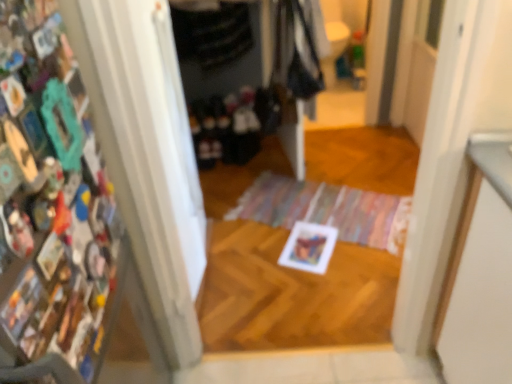
Image resolution: width=512 pixels, height=384 pixels. What do you see at coordinates (212, 33) in the screenshot?
I see `dark gray fabric at upper center, the 2th clothing ordered from the bottom` at bounding box center [212, 33].

You are a GUI agent. You are given a task and a screenshot of the screen. Output one action in this format:
    pyautogui.click(x=<x>, y=<y>)
    Task: Click on the dark fabric clothes at center, which ranks as the 2th clothing in top-to-bottom order
    This screenshot has height=384, width=512.
    Given the screenshot: What is the action you would take?
    pyautogui.click(x=233, y=125)

The height and width of the screenshot is (384, 512). Identify the location of dark gray fabric at upper center, the first clothing viewed from the top. click(x=212, y=33).

Is dark fabric clothes at center, which ranks as the 2th clothing in top-to-bottom order, not within multicolored collage at left?

Yes.

Is dark fabric clothes at center, which ranks as the 2th clothing in top-to-bottom order, behind multicolored collage at left?

Yes, the depth of dark fabric clothes at center, which ranks as the 2th clothing in top-to-bottom order, is greater than that of multicolored collage at left.

I want to click on book that appears above the dark fabric clothes at center, arranged as the first clothing when ordered from the bottom (from a real-world perspective), so click(x=50, y=199).

From a real-world perspective, is dark fabric clothes at center, arranged as the first clothing when ordered from the bottom, over multicolored collage at left?

Actually, dark fabric clothes at center, arranged as the first clothing when ordered from the bottom, is physically below multicolored collage at left in the real world.

How different are the orientations of dark gray fabric at upper center, the first clothing viewed from the top, and multicolored collage at left in degrees?

The angle between the facing direction of dark gray fabric at upper center, the first clothing viewed from the top, and the facing direction of multicolored collage at left is 92.2 degrees.

Is dark gray fabric at upper center, the 2th clothing ordered from the bottom, positioned with its back to multicolored collage at left?

No, dark gray fabric at upper center, the 2th clothing ordered from the bottom, is not facing the opposite direction of multicolored collage at left.

Where is `clothing that is the 1st one when counting backward from the multicolored collage at left`? The image size is (512, 384). clothing that is the 1st one when counting backward from the multicolored collage at left is located at coordinates (212, 33).

Which object is thinner, dark gray fabric at upper center, the first clothing viewed from the top, or multicolored collage at left?

Thinner between the two is multicolored collage at left.

From the image's perspective, is multicolored collage at left over multicolored woven mat at center?

Yes, from the image's perspective, multicolored collage at left is on top of multicolored woven mat at center.

Is multicolored collage at left looking in the opposite direction of multicolored woven mat at center?

No, multicolored woven mat at center is not at the back of multicolored collage at left.

How different are the orientations of multicolored collage at left and multicolored woven mat at center in degrees?

multicolored collage at left and multicolored woven mat at center are facing 116 degrees away from each other.

From a real-world perspective, is multicolored collage at left over multicolored woven mat at center?

Yes, from a real-world perspective, multicolored collage at left is over multicolored woven mat at center

The width and height of the screenshot is (512, 384). Find the location of `the 1st clothing positioned above the multicolored collage at left (from the image's perspective)`. the 1st clothing positioned above the multicolored collage at left (from the image's perspective) is located at coordinates (233, 125).

Is point (38, 97) positioned before point (214, 96)?

Yes, point (38, 97) is in front of point (214, 96).

From a real-world perspective, is multicolored collage at left physically located above or below dark fabric clothes at center, which ranks as the 2th clothing in top-to-bottom order?

Clearly, from a real-world perspective, multicolored collage at left is above dark fabric clothes at center, which ranks as the 2th clothing in top-to-bottom order.

From the picture: How different are the orientations of dark fabric clothes at center, which ranks as the 2th clothing in top-to-bottom order, and multicolored woven mat at center in degrees?

They differ by 24 degrees in their facing directions.

Can you confirm if dark fabric clothes at center, arranged as the first clothing when ordered from the bottom, is smaller than multicolored woven mat at center?

Incorrect, dark fabric clothes at center, arranged as the first clothing when ordered from the bottom, is not smaller in size than multicolored woven mat at center.

Where is `doormat located on the right of dark fabric clothes at center, which ranks as the 2th clothing in top-to-bottom order`? The height and width of the screenshot is (384, 512). doormat located on the right of dark fabric clothes at center, which ranks as the 2th clothing in top-to-bottom order is located at coordinates (327, 210).

Is dark fabric clothes at center, arranged as the first clothing when ordered from the bottom, completely or partially outside of multicolored woven mat at center?

dark fabric clothes at center, arranged as the first clothing when ordered from the bottom, is positioned outside multicolored woven mat at center.

Between dark fabric clothes at center, arranged as the first clothing when ordered from the bottom, and dark gray fabric at upper center, the 2th clothing ordered from the bottom, which one has more height?

dark gray fabric at upper center, the 2th clothing ordered from the bottom.

From the picture: Which object is positioned more to the left, dark fabric clothes at center, arranged as the first clothing when ordered from the bottom, or dark gray fabric at upper center, the 2th clothing ordered from the bottom?

dark gray fabric at upper center, the 2th clothing ordered from the bottom.

Are dark fabric clothes at center, which ranks as the 2th clothing in top-to-bottom order, and dark gray fabric at upper center, the 2th clothing ordered from the bottom, far apart?

No, there isn't a large distance between dark fabric clothes at center, which ranks as the 2th clothing in top-to-bottom order, and dark gray fabric at upper center, the 2th clothing ordered from the bottom.

From the picture: Is dark fabric clothes at center, which ranks as the 2th clothing in top-to-bottom order, positioned with its back to dark gray fabric at upper center, the 2th clothing ordered from the bottom?

No, dark fabric clothes at center, which ranks as the 2th clothing in top-to-bottom order,'s orientation is not away from dark gray fabric at upper center, the 2th clothing ordered from the bottom.

From a real-world perspective, is multicolored woven mat at center physically located above or below multicolored collage at left?

From a real-world perspective, multicolored woven mat at center is physically below multicolored collage at left.

Does multicolored woven mat at center have a larger size compared to multicolored collage at left?

Indeed, multicolored woven mat at center has a larger size compared to multicolored collage at left.

Does point (371, 245) come closer to viewer compared to point (32, 108)?

No, (371, 245) is behind (32, 108).

I want to click on book on the left of multicolored woven mat at center, so click(x=50, y=199).

Where is `book in front of the dark fabric clothes at center, which ranks as the 2th clothing in top-to-bottom order`? This screenshot has height=384, width=512. book in front of the dark fabric clothes at center, which ranks as the 2th clothing in top-to-bottom order is located at coordinates pyautogui.click(x=50, y=199).

From the multicolored collage at left, count 1st clothing to the right and point to it. Please provide its 2D coordinates.

[(212, 33)]

Based on their spatial positions, is multicolored collage at left or dark fabric clothes at center, arranged as the first clothing when ordered from the bottom, further from multicolored woven mat at center?

multicolored collage at left lies further to multicolored woven mat at center than the other object.

Based on their spatial positions, is multicolored woven mat at center or dark gray fabric at upper center, the first clothing viewed from the top, closer to dark fabric clothes at center, arranged as the first clothing when ordered from the bottom?

dark gray fabric at upper center, the first clothing viewed from the top, lies closer to dark fabric clothes at center, arranged as the first clothing when ordered from the bottom, than the other object.

Considering their positions, is dark fabric clothes at center, which ranks as the 2th clothing in top-to-bottom order, positioned closer to dark gray fabric at upper center, the 2th clothing ordered from the bottom, than multicolored collage at left?

dark fabric clothes at center, which ranks as the 2th clothing in top-to-bottom order, is closer to dark gray fabric at upper center, the 2th clothing ordered from the bottom.

Looking at the image, which one is located closer to dark gray fabric at upper center, the 2th clothing ordered from the bottom, multicolored woven mat at center or dark fabric clothes at center, which ranks as the 2th clothing in top-to-bottom order?

dark fabric clothes at center, which ranks as the 2th clothing in top-to-bottom order, is positioned closer to the anchor dark gray fabric at upper center, the 2th clothing ordered from the bottom.

Considering their positions, is dark gray fabric at upper center, the 2th clothing ordered from the bottom, positioned closer to multicolored woven mat at center than dark fabric clothes at center, arranged as the first clothing when ordered from the bottom?

dark fabric clothes at center, arranged as the first clothing when ordered from the bottom, is closer to multicolored woven mat at center.

Based on their spatial positions, is dark gray fabric at upper center, the first clothing viewed from the top, or multicolored woven mat at center further from dark fabric clothes at center, which ranks as the 2th clothing in top-to-bottom order?

multicolored woven mat at center.

Estimate the real-world distances between objects in this image. Which object is further from multicolored collage at left, dark gray fabric at upper center, the first clothing viewed from the top, or multicolored woven mat at center?

dark gray fabric at upper center, the first clothing viewed from the top, is further to multicolored collage at left.

Which object lies further to the anchor point multicolored collage at left, multicolored woven mat at center or dark gray fabric at upper center, the 2th clothing ordered from the bottom?

Based on the image, dark gray fabric at upper center, the 2th clothing ordered from the bottom, appears to be further to multicolored collage at left.

Image resolution: width=512 pixels, height=384 pixels. Find the location of `clothing between dark gray fabric at upper center, the 2th clothing ordered from the bottom, and multicolored woven mat at center from top to bottom`. clothing between dark gray fabric at upper center, the 2th clothing ordered from the bottom, and multicolored woven mat at center from top to bottom is located at coordinates (233, 125).

Identify the location of doormat between multicolored collage at left and dark gray fabric at upper center, the 2th clothing ordered from the bottom, along the z-axis. [327, 210].

The width and height of the screenshot is (512, 384). I want to click on clothing located between multicolored collage at left and dark fabric clothes at center, arranged as the first clothing when ordered from the bottom, in the depth direction, so click(x=212, y=33).

Image resolution: width=512 pixels, height=384 pixels. What are the coordinates of `doormat positioned between multicolored collage at left and dark fabric clothes at center, which ranks as the 2th clothing in top-to-bottom order, from near to far` in the screenshot? It's located at (x=327, y=210).